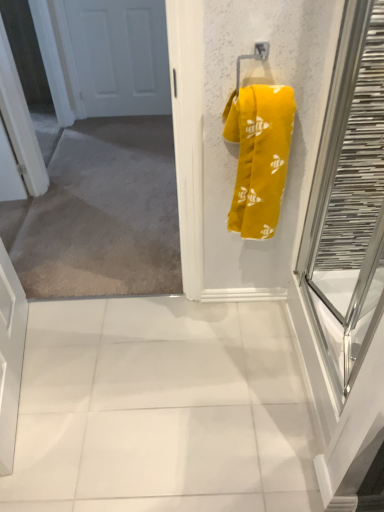
Question: Considering their positions, is white matte door at upper left located in front of or behind white glossy tile at center?

Choices:
 (A) front
 (B) behind

Answer: (B)

Question: Considering the relative positions of white matte door at upper left and white glossy tile at center in the image provided, is white matte door at upper left to the left or to the right of white glossy tile at center?

Choices:
 (A) right
 (B) left

Answer: (B)

Question: Which is farther from the white matte door at upper left?

Choices:
 (A) clear glass door at right
 (B) yellow fabric towel at upper right
 (C) white glossy tile at center

Answer: (C)

Question: Estimate the real-world distances between objects in this image. Which object is farther from the clear glass door at right?

Choices:
 (A) yellow fabric towel at upper right
 (B) white glossy tile at center
 (C) white matte door at upper left

Answer: (C)